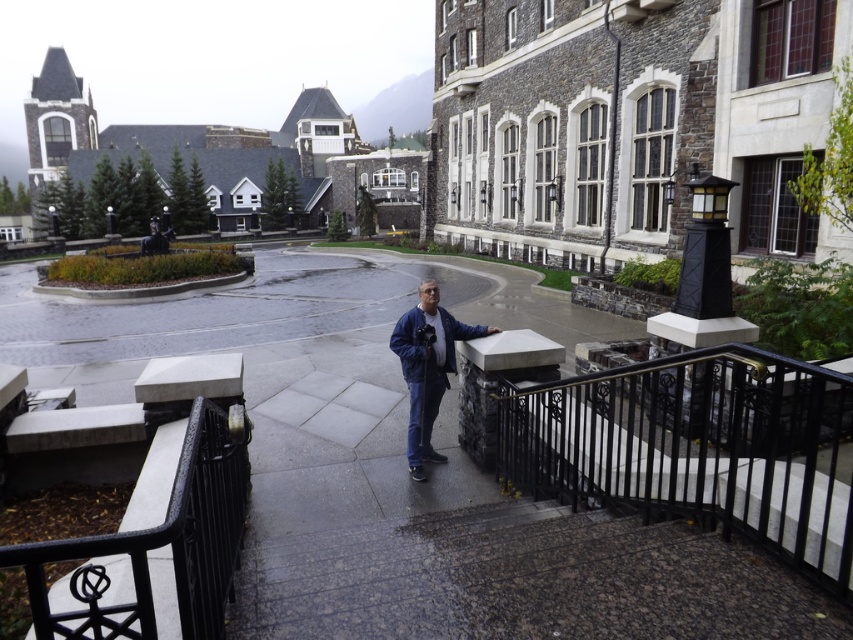
You are a photographer standing at the scene. You want to position your camera so that the black wrought iron railing at center is in the foreground and the blue denim jacket at center is in the background. Is this possible based on their current positions?

The black wrought iron railing at center is located below the blue denim jacket at center, so yes, positioning the camera to have the railing in the foreground and the jacket in the background is possible since the railing is lower and closer to the camera while the jacket is higher and further away.

You are a photographer standing at the center of the scene. You notice the black wrought iron railing at center and the blue denim jacket at center. Which object is taller?

The blue denim jacket at center is taller than the black wrought iron railing at center.